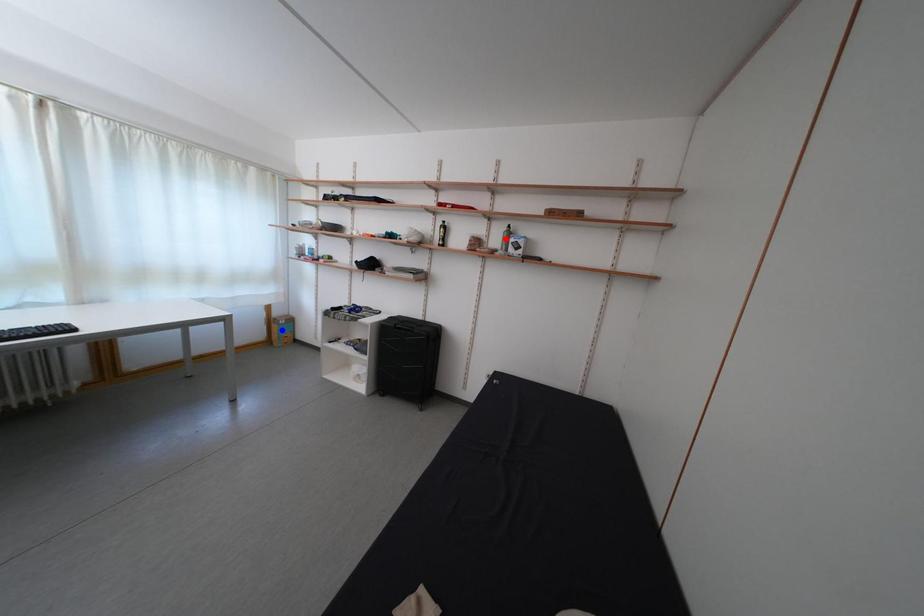
Question: Which of the two points in the image is closer to the camera?

Choices:
 (A) Blue point is closer.
 (B) Red point is closer.

Answer: (B)